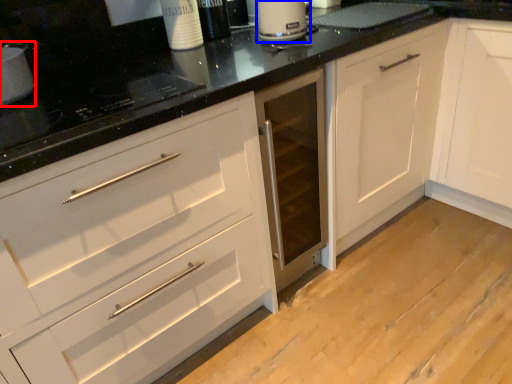
Question: Which object appears closest to the camera in this image, appliance (highlighted by a red box) or kitchen appliance (highlighted by a blue box)?

Choices:
 (A) appliance
 (B) kitchen appliance

Answer: (A)